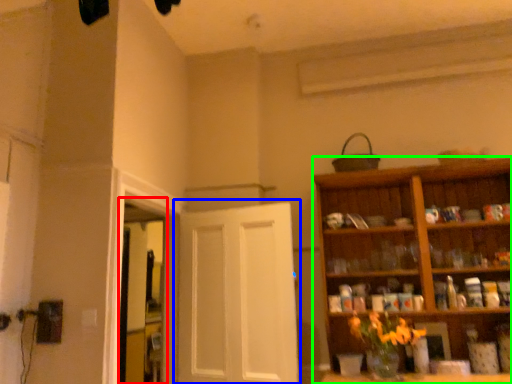
Question: Based on their relative distances, which object is nearer to window (highlighted by a red box)? Choose from door (highlighted by a blue box) and cabinetry (highlighted by a green box).

Choices:
 (A) door
 (B) cabinetry

Answer: (A)